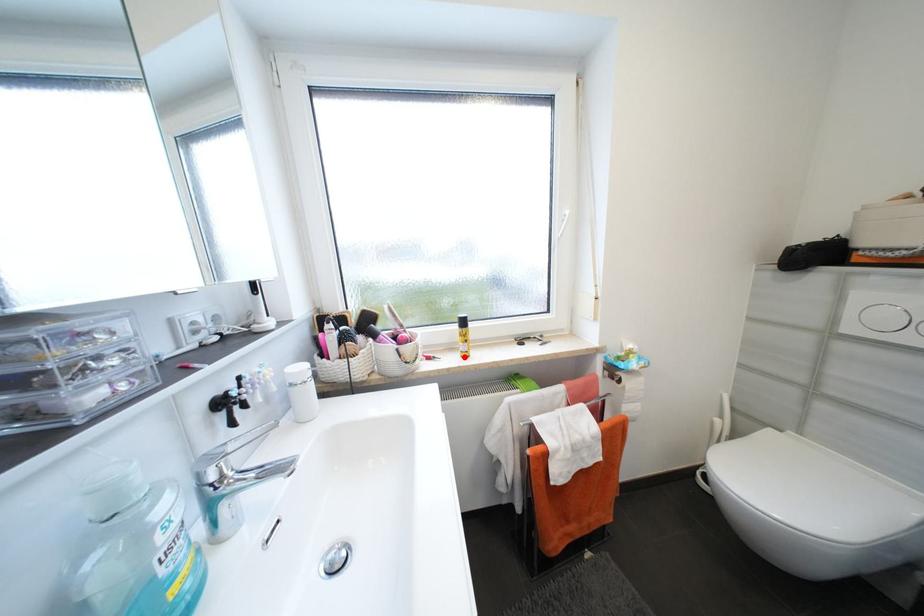
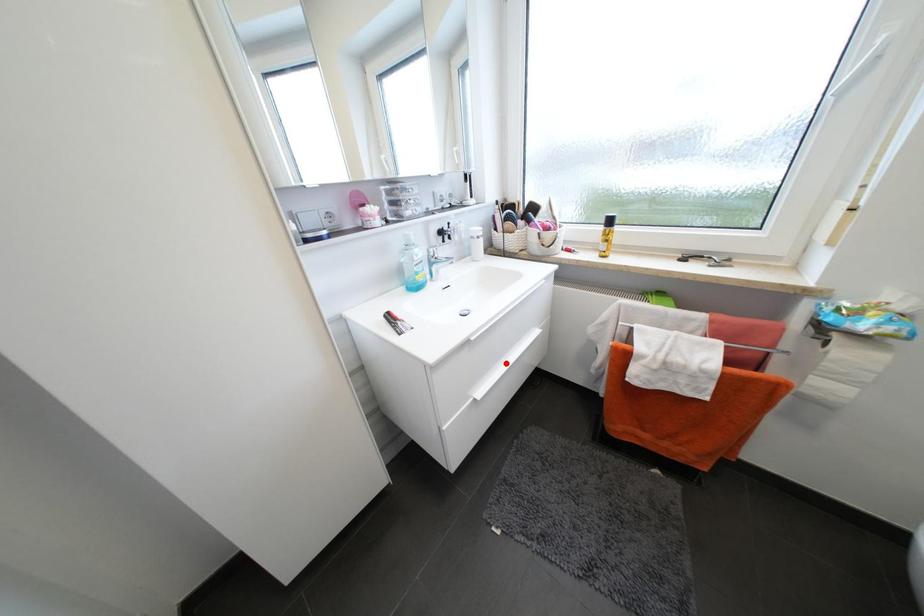
Based on the photo, I am providing you with two images of the same scene from different viewpoints. A red point is marked on the first image and another point is marked on the second image. Are the points marked in image1 and image2 representing the same 3D position?

No